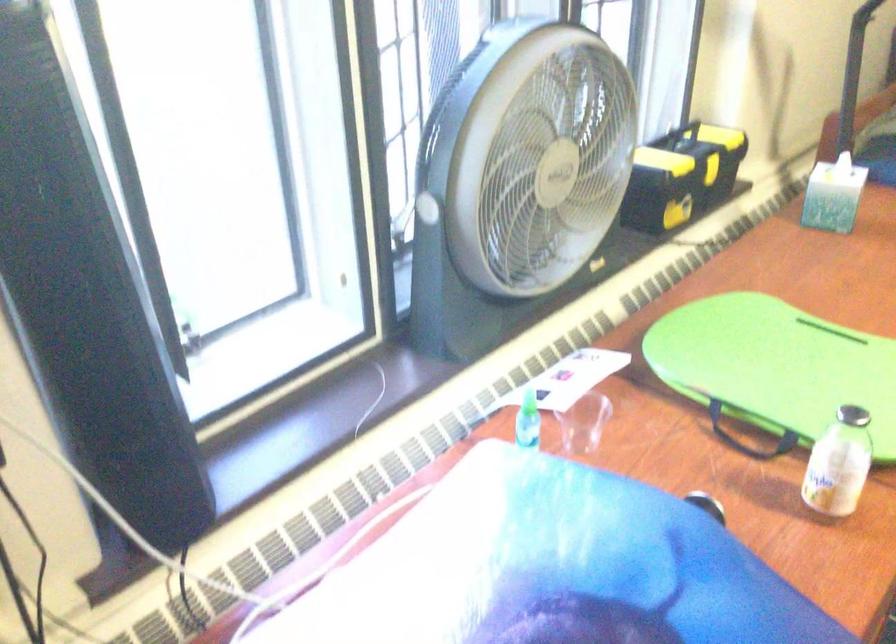
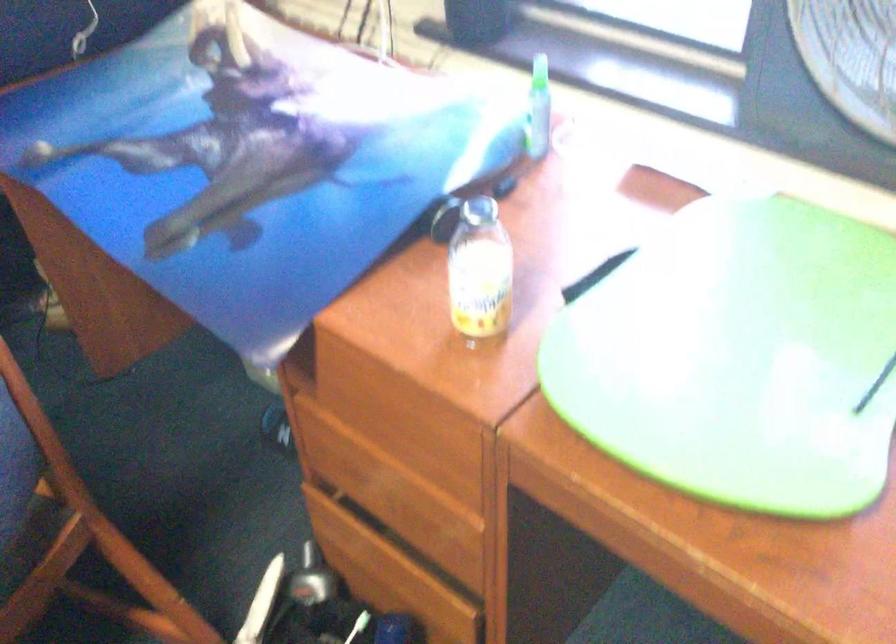
Where in the second image is the point corresponding to pixel 764 488 from the first image?

(479, 270)